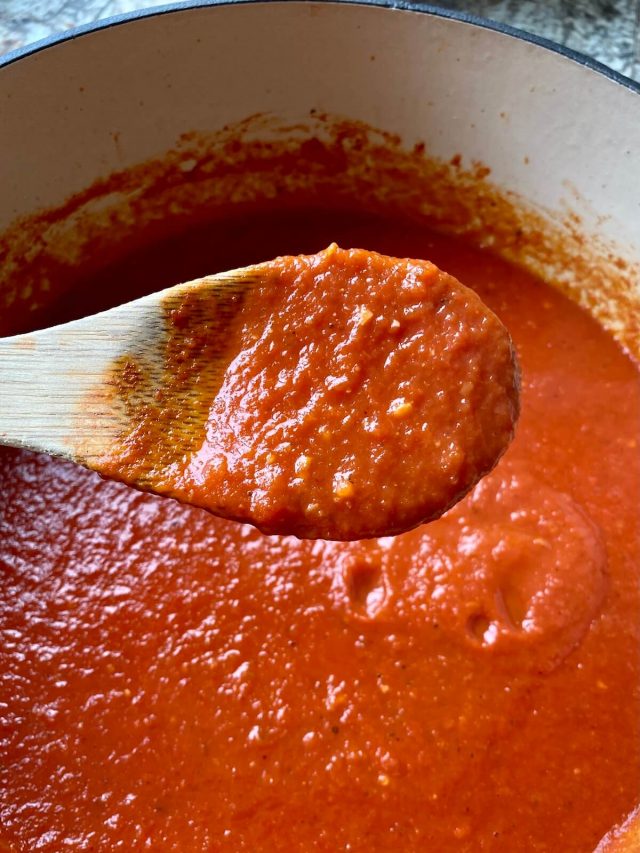
Find the location of `pot`. pot is located at coordinates (595, 217).